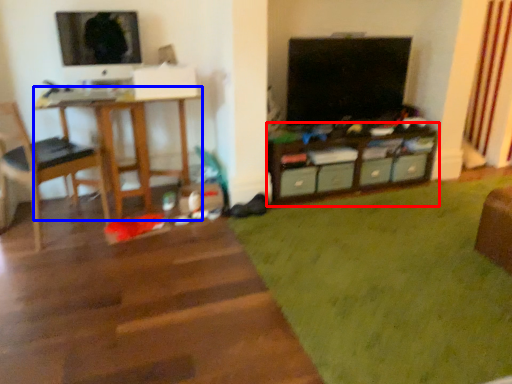
Question: Which object appears farthest to the camera in this image, shelf (highlighted by a red box) or desk (highlighted by a blue box)?

Choices:
 (A) shelf
 (B) desk

Answer: (A)